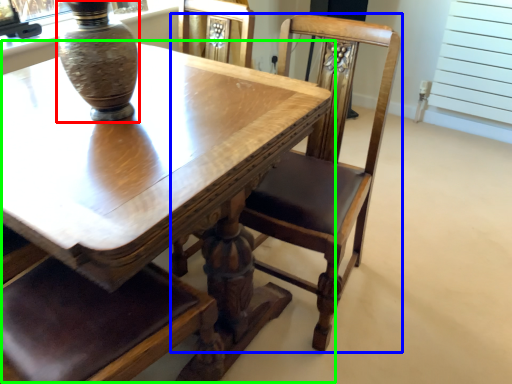
Question: Which is nearer to the vase (highlighted by a red box)? chair (highlighted by a blue box) or table (highlighted by a green box).

Choices:
 (A) chair
 (B) table

Answer: (B)